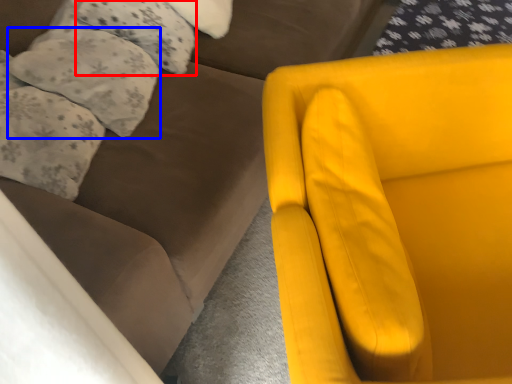
Question: Which point is closer to the camera, pillow (highlighted by a red box) or pillow (highlighted by a blue box)?

Choices:
 (A) pillow
 (B) pillow

Answer: (B)